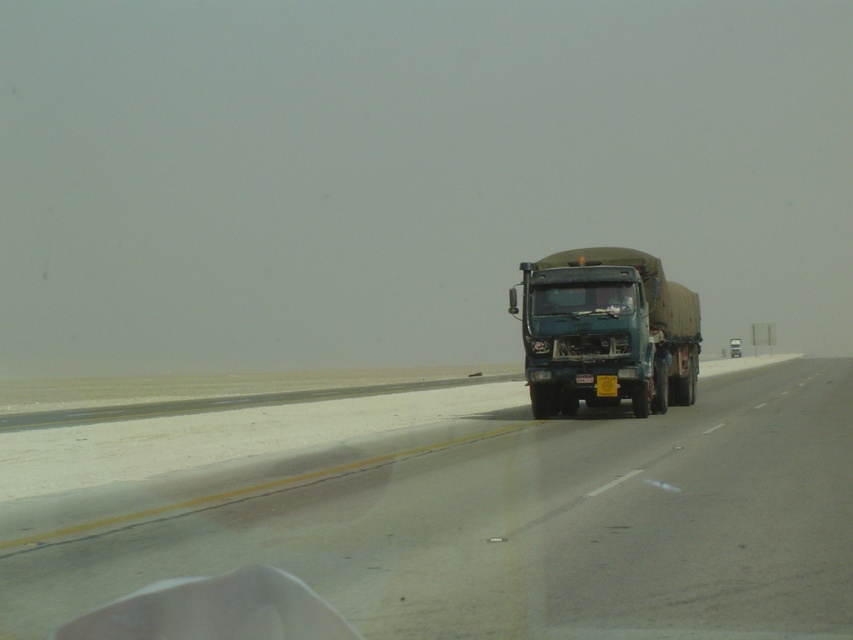
You are a drone operator trying to capture the smooth asphalt highway at center from above. What are the coordinates where you should position your drone to get the best shot?

The smooth asphalt highway at center is located at coordinates (502,522), so the drone should be positioned there for the best shot.

You are driving a car and see the green matte truck at center ahead. If your car can brake at 8 m per second squared, how many seconds do you have before collision if you start braking now?

The green matte truck at center is 24.65 meters away. Using the braking distance formula, the time to collision can be calculated. However, without the current speed, an exact time cannot be determined. Please provide your current speed to calculate the braking time.

You are driving a car and notice a green matte truck at center and a transparent glass windshield at center. Which object is closer to you, the driver?

The green matte truck at center is closer to you because it is positioned below the transparent glass windshield at center, indicating it is in front of the windshield from your perspective.